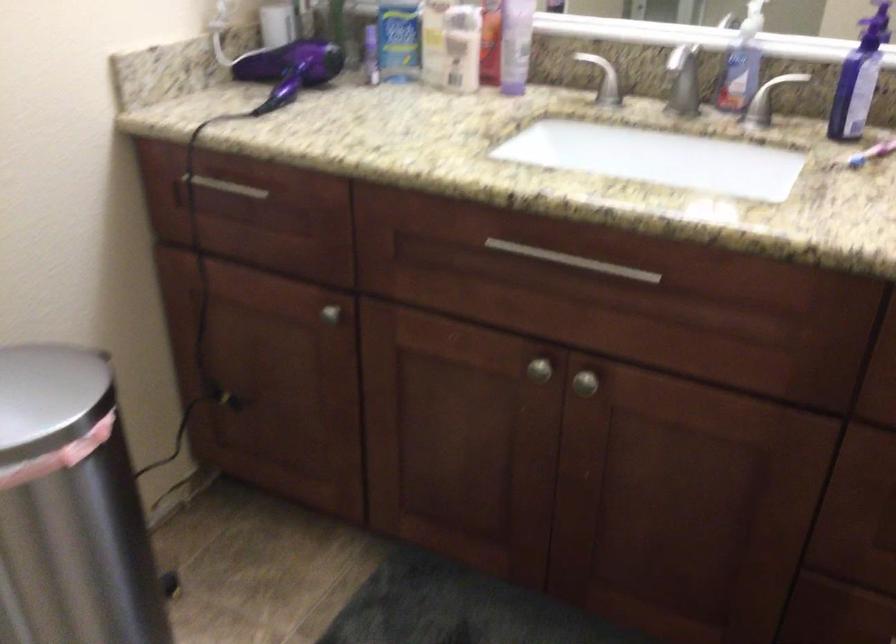
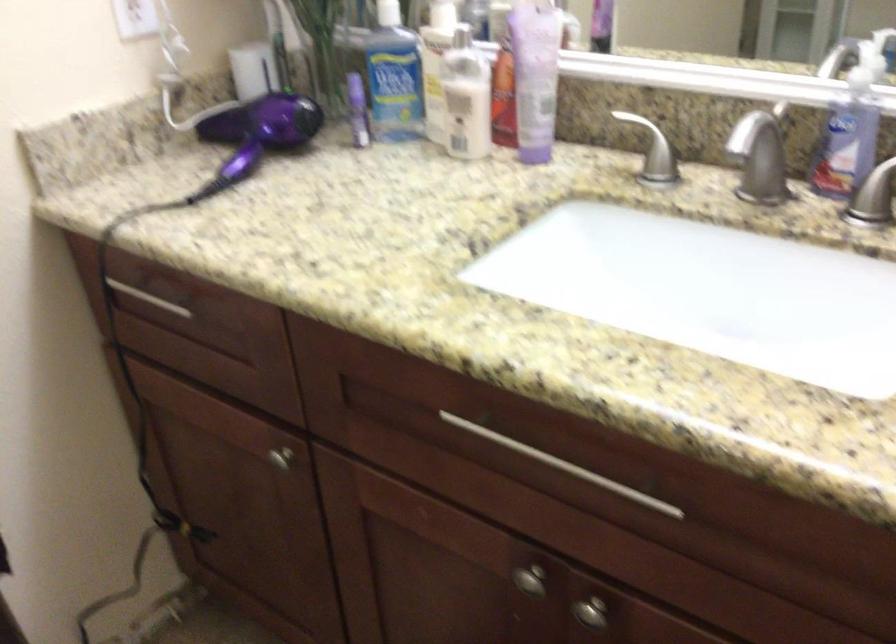
Where in the second image is the point corresponding to (x=546, y=368) from the first image?

(530, 580)